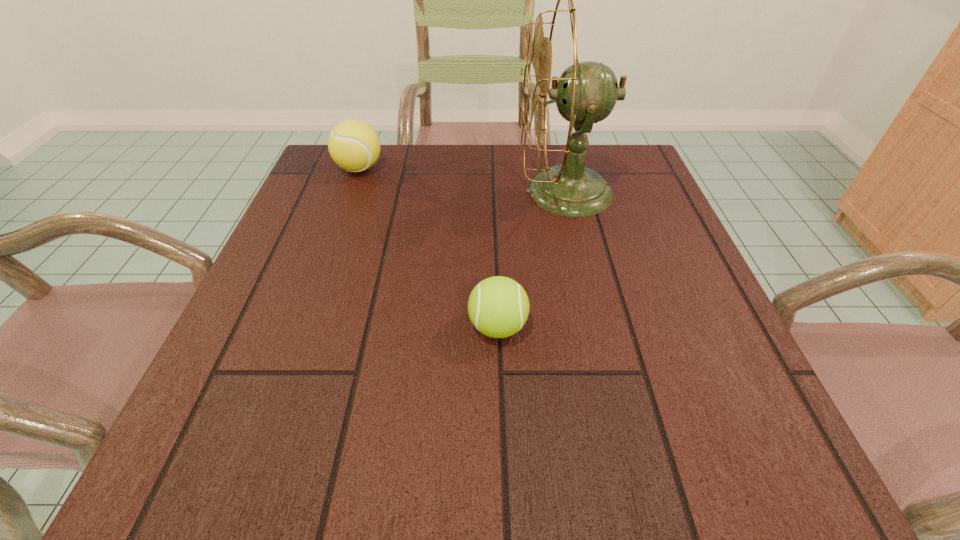
Where is `vacant area situated 0.310m on the back of the shortest object`? The image size is (960, 540). vacant area situated 0.310m on the back of the shortest object is located at coordinates (493, 198).

Where is `fan that is positioned at the far edge`? fan that is positioned at the far edge is located at coordinates (586, 93).

This screenshot has height=540, width=960. Find the location of `tennis ball that is at the far edge`. tennis ball that is at the far edge is located at coordinates (354, 146).

Where is `object that is positioned at the left edge`? object that is positioned at the left edge is located at coordinates (354, 146).

Locate an element on the screen. object that is at the right edge is located at coordinates (586, 93).

Where is `object located in the far left corner section of the desktop`? The width and height of the screenshot is (960, 540). object located in the far left corner section of the desktop is located at coordinates (354, 146).

Locate an element on the screen. object at the far right corner is located at coordinates (586, 93).

Where is `vacant space at the far edge of the desktop`? vacant space at the far edge of the desktop is located at coordinates (419, 144).

Image resolution: width=960 pixels, height=540 pixels. In order to click on vacant space at the near edge of the desktop in this screenshot , I will do `click(378, 436)`.

The height and width of the screenshot is (540, 960). I want to click on free spot at the left edge of the desktop, so click(x=254, y=403).